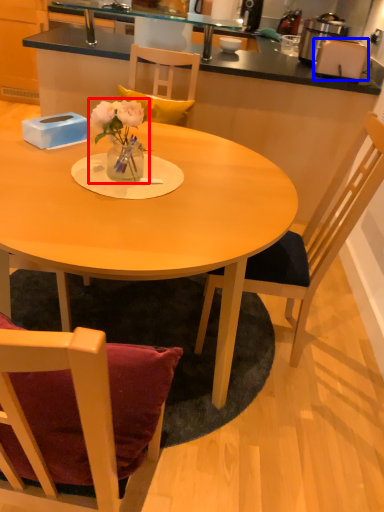
Question: Which object is further to the camera taking this photo, floral arrangement (highlighted by a red box) or toaster (highlighted by a blue box)?

Choices:
 (A) floral arrangement
 (B) toaster

Answer: (B)